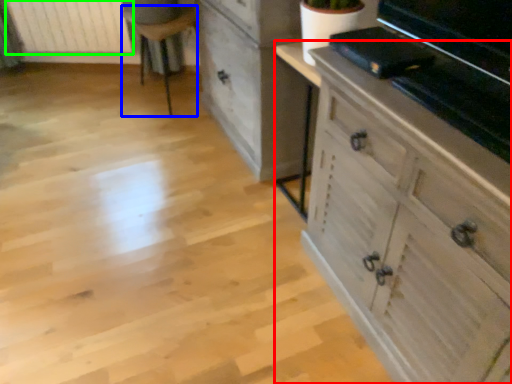
Question: Which is nearer to the chest of drawers (highlighted by a red box)? furniture (highlighted by a blue box) or radiator (highlighted by a green box).

Choices:
 (A) furniture
 (B) radiator

Answer: (A)